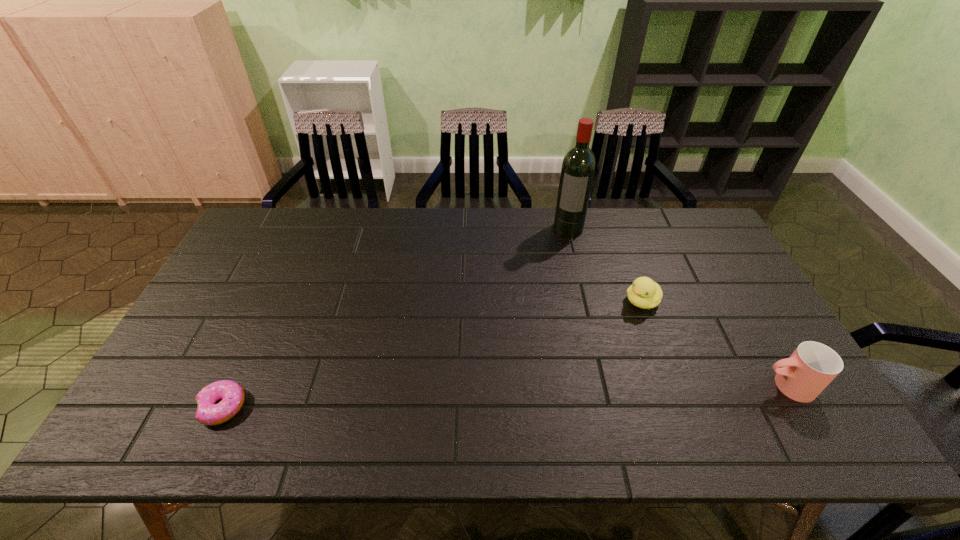
Identify the location of cup located at the near edge. Image resolution: width=960 pixels, height=540 pixels. (809, 370).

You are a GUI agent. You are given a task and a screenshot of the screen. Output one action in this format:
    pyautogui.click(x=<x>, y=<y>)
    Task: Click on the object situated at the left edge
    This screenshot has width=960, height=540.
    Given the screenshot: What is the action you would take?
    pyautogui.click(x=231, y=394)

What are the coordinates of `object present at the right edge` in the screenshot? It's located at (809, 370).

In order to click on object that is positioned at the near left corner in this screenshot , I will do point(231,394).

The image size is (960, 540). What are the coordinates of `object situated at the near right corner` in the screenshot? It's located at (809, 370).

Find the location of a particular element. Image resolution: width=960 pixels, height=540 pixels. vacant space at the far edge is located at coordinates (485, 220).

The image size is (960, 540). Find the location of `vacant space at the near edge of the desktop`. vacant space at the near edge of the desktop is located at coordinates (421, 381).

Locate an element on the screen. The height and width of the screenshot is (540, 960). vacant area at the left edge is located at coordinates (248, 279).

Identify the location of vacant space at the right edge. (683, 260).

In the image, there is a desktop. Identify the location of blank space at the far left corner. (282, 227).